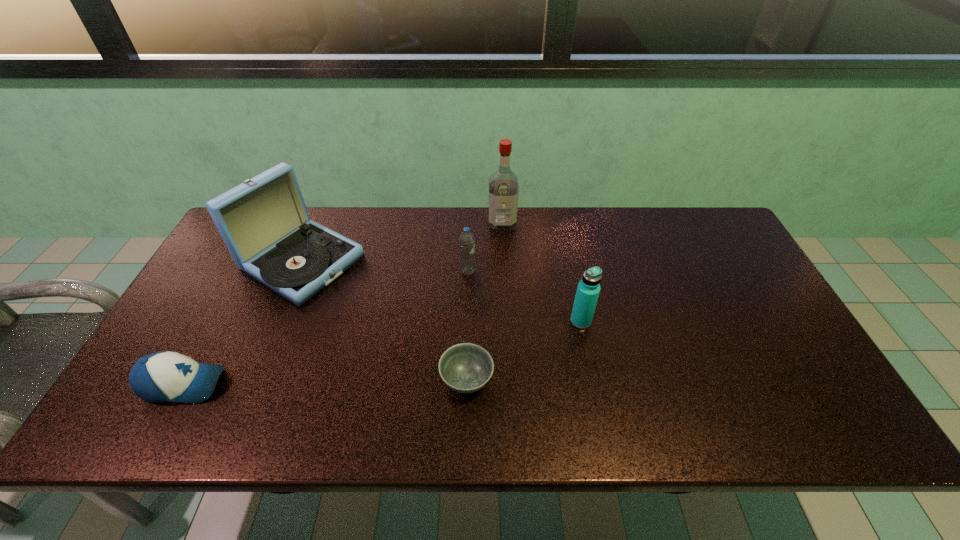
Identify the location of object situated at the far left corner. (264, 222).

This screenshot has width=960, height=540. Find the location of `object that is at the near left corner`. object that is at the near left corner is located at coordinates [x=166, y=376].

The height and width of the screenshot is (540, 960). In the image, there is a desktop. In order to click on vacant space at the far edge in this screenshot , I will do `click(552, 228)`.

The image size is (960, 540). What are the coordinates of `free space at the near edge` in the screenshot? It's located at (520, 421).

Locate an element on the screen. The image size is (960, 540). vacant space at the left edge of the desktop is located at coordinates (204, 286).

In the image, there is a desktop. Identify the location of blank space at the right edge. (804, 361).

In the image, there is a desktop. Where is `vacant space at the near left corner`? This screenshot has height=540, width=960. vacant space at the near left corner is located at coordinates (161, 404).

This screenshot has width=960, height=540. Identify the location of blank space at the near right corner. (792, 429).

What are the coordinates of `empty space between the phonograph record and the farther water bottle` in the screenshot? It's located at (385, 267).

Image resolution: width=960 pixels, height=540 pixels. In order to click on vacant space that is in between the bowl and the right water bottle in this screenshot , I will do `click(524, 350)`.